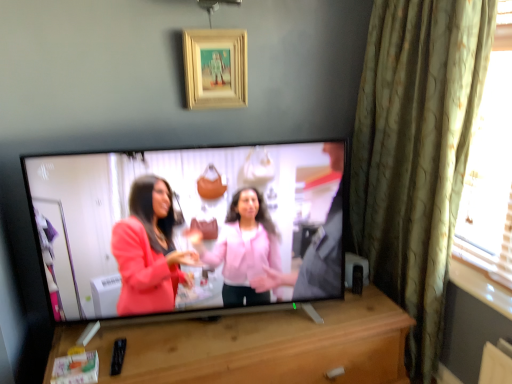
Question: Considering the relative positions of matte black tv at center and green textured curtain at right in the image provided, is matte black tv at center to the left of green textured curtain at right from the viewer's perspective?

Choices:
 (A) no
 (B) yes

Answer: (B)

Question: Is matte black tv at center turned away from green textured curtain at right?

Choices:
 (A) yes
 (B) no

Answer: (B)

Question: Is the position of matte black tv at center more distant than that of green textured curtain at right?

Choices:
 (A) no
 (B) yes

Answer: (B)

Question: Would you say green textured curtain at right is part of matte black tv at center's contents?

Choices:
 (A) yes
 (B) no

Answer: (B)

Question: Is matte black tv at center at the right side of green textured curtain at right?

Choices:
 (A) no
 (B) yes

Answer: (A)

Question: From a real-world perspective, is wooden cabinet at center physically located above or below green textured curtain at right?

Choices:
 (A) below
 (B) above

Answer: (A)

Question: In terms of height, does wooden cabinet at center look taller or shorter compared to green textured curtain at right?

Choices:
 (A) tall
 (B) short

Answer: (B)

Question: Based on their sizes in the image, would you say wooden cabinet at center is bigger or smaller than green textured curtain at right?

Choices:
 (A) small
 (B) big

Answer: (B)

Question: From the image's perspective, relative to green textured curtain at right, is wooden cabinet at center above or below?

Choices:
 (A) below
 (B) above

Answer: (A)

Question: Is green textured curtain at right bigger or smaller than wooden picture frame at upper center?

Choices:
 (A) small
 (B) big

Answer: (B)

Question: Considering the positions of green textured curtain at right and wooden picture frame at upper center in the image, is green textured curtain at right taller or shorter than wooden picture frame at upper center?

Choices:
 (A) short
 (B) tall

Answer: (B)

Question: Which is correct: green textured curtain at right is inside wooden picture frame at upper center, or outside of it?

Choices:
 (A) outside
 (B) inside

Answer: (A)

Question: From a real-world perspective, is green textured curtain at right physically located above or below wooden picture frame at upper center?

Choices:
 (A) below
 (B) above

Answer: (A)

Question: Considering the positions of green textured curtain at right and wooden cabinet at center in the image, is green textured curtain at right taller or shorter than wooden cabinet at center?

Choices:
 (A) tall
 (B) short

Answer: (A)

Question: From a real-world perspective, is green textured curtain at right positioned above or below wooden cabinet at center?

Choices:
 (A) above
 (B) below

Answer: (A)